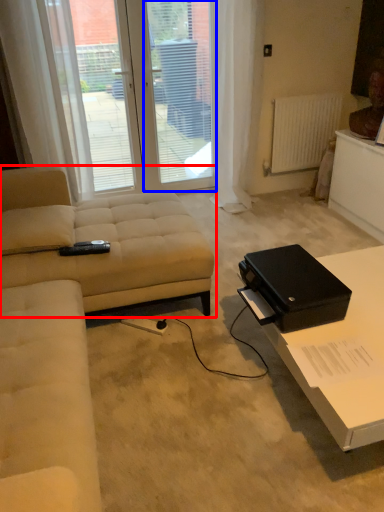
Question: Which of the following is the farthest to the observer, studio couch (highlighted by a red box) or screen door (highlighted by a blue box)?

Choices:
 (A) studio couch
 (B) screen door

Answer: (B)